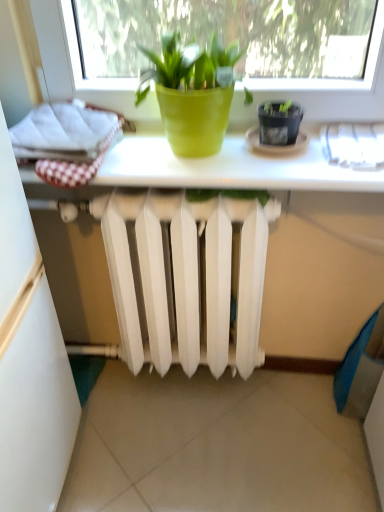
Question: From the image's perspective, is green matte pot at center above or below black plastic flowerpot at upper right?

Choices:
 (A) below
 (B) above

Answer: (B)

Question: Looking at their shapes, would you say green matte pot at center is wider or thinner than black plastic flowerpot at upper right?

Choices:
 (A) thin
 (B) wide

Answer: (B)

Question: Would you say green matte pot at center is inside or outside black plastic flowerpot at upper right?

Choices:
 (A) outside
 (B) inside

Answer: (A)

Question: From a real-world perspective, is black plastic flowerpot at upper right above or below green matte pot at center?

Choices:
 (A) below
 (B) above

Answer: (A)

Question: Is point (296, 112) closer or farther from the camera than point (198, 135)?

Choices:
 (A) farther
 (B) closer

Answer: (A)

Question: In the image, is black plastic flowerpot at upper right on the left side or the right side of green matte pot at center?

Choices:
 (A) right
 (B) left

Answer: (A)

Question: In terms of width, does black plastic flowerpot at upper right look wider or thinner when compared to green matte pot at center?

Choices:
 (A) thin
 (B) wide

Answer: (A)